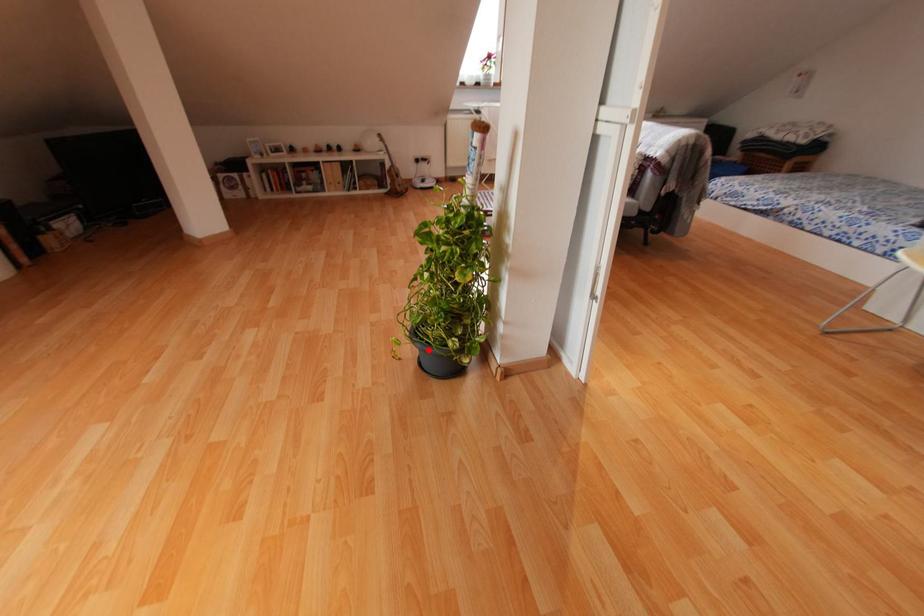
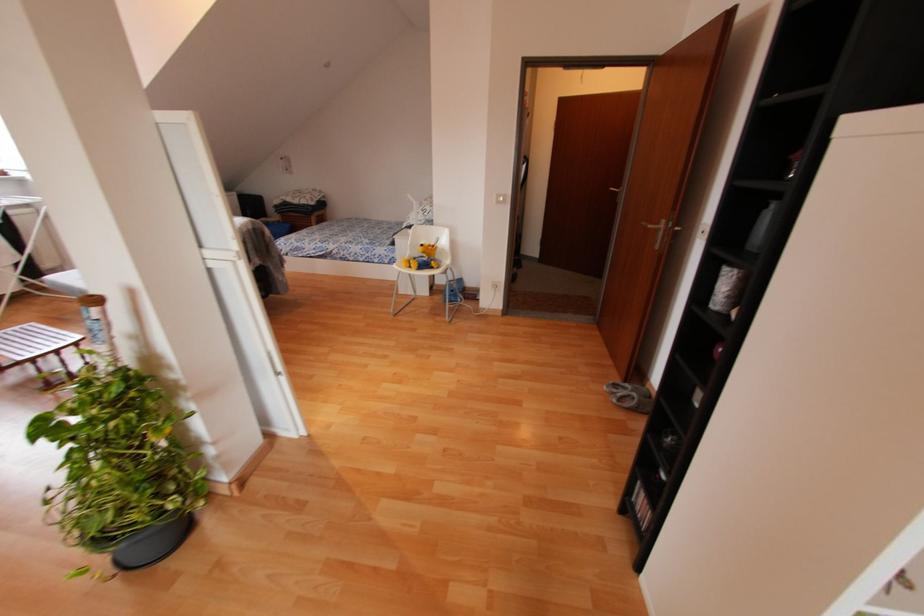
Find the pixel in the second image that matches the highlighted location in the first image.

(140, 538)